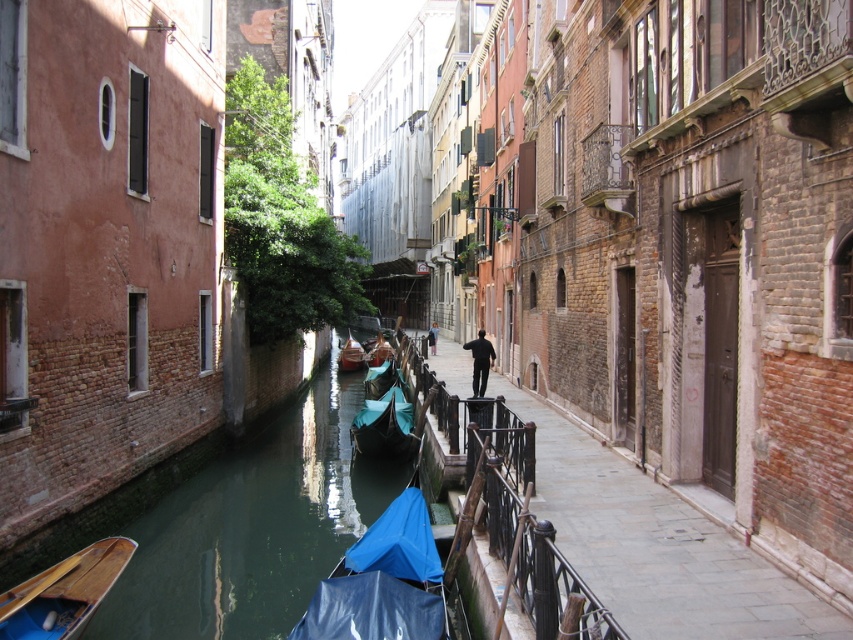
You are a tourist standing at the edge of the canal and want to take a photo of both the blue tarpaulin boat at lower center and the teal fabric boat at center. Which boat should you focus on first to ensure both are in the frame?

You should focus on the teal fabric boat at center first because the blue tarpaulin boat at lower center is in front of it, so adjusting the camera to include the teal fabric boat will naturally include the blue tarpaulin boat as well.

You are standing at the edge of the canal in Venice and want to reach a specific point marked at coordinates point (x=410, y=636). If your maximum comfortable walking distance is 25 feet, can you comfortably walk to that point without needing assistance?

The distance of point (x=410, y=636) from camera is 24.84 feet, so yes, you can comfortably walk to that point since it is within your 25 feet limit.

You are standing on the canal bank and want to board a boat. Which boat is closer to the water surface, the blue tarpaulin boat at lower center or the teal fabric boat at center?

The blue tarpaulin boat at lower center is located below the teal fabric boat at center, so it is closer to the water surface.